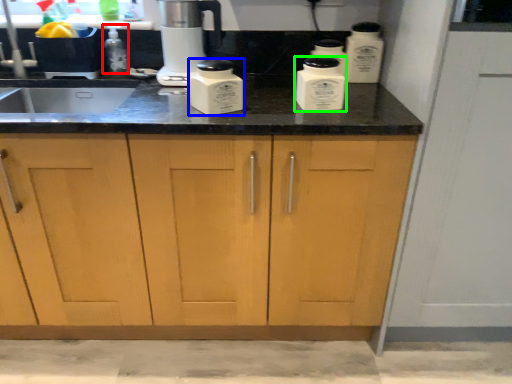
Question: Which is nearer to the bottle (highlighted by a red box)? kitchen appliance (highlighted by a blue box) or kitchen appliance (highlighted by a green box).

Choices:
 (A) kitchen appliance
 (B) kitchen appliance

Answer: (A)